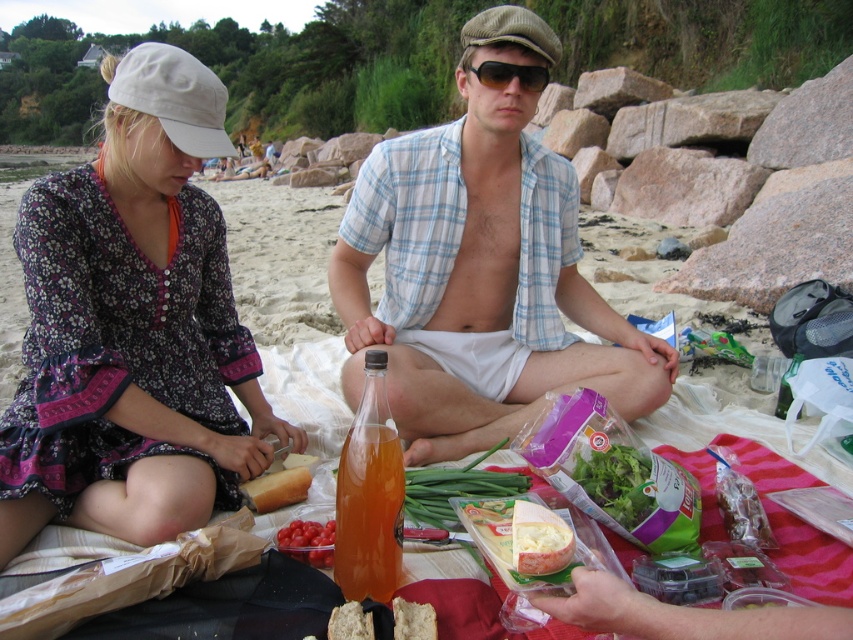
You are taking a photo of the picnic scene and want to focus on both the point at (398, 440) and the point at (634, 449). Which point should you adjust your focus to ensure it is sharp for the closer object?

You should focus on the point at (398, 440) because it is closer to the camera than the point at (634, 449).

Based on the photo, you are standing at the origin of the coordinate system in the picnic scene. You want to walk to the point at (334,536) but there is an obstacle at point (610,465). Can you reach your destination without passing through the obstacle?

Point (610,465) is behind point (334,536), so you can reach the destination without passing through the obstacle.

You are planning to take a photo of the picnic scene. You want to ensure both the translucent orange liquid at center and the green leafy salad at center are clearly visible. Which object should you focus on first to ensure proper depth of field?

The translucent orange liquid at center has a greater height compared to the green leafy salad at center, so you should focus on the translucent orange liquid at center first to ensure both objects are in focus.